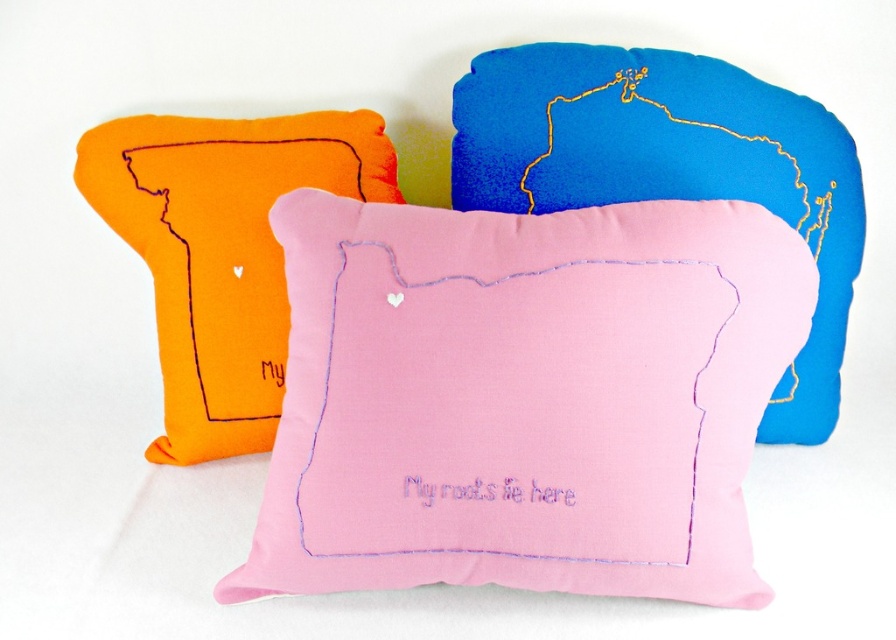
Does pink fabric pillow at center have a lesser height compared to orange felt pillow at left?

No, pink fabric pillow at center is not shorter than orange felt pillow at left.

What do you see at coordinates (524, 397) in the screenshot?
I see `pink fabric pillow at center` at bounding box center [524, 397].

Image resolution: width=896 pixels, height=640 pixels. Describe the element at coordinates (524, 397) in the screenshot. I see `pink fabric pillow at center` at that location.

Identify the location of pink fabric pillow at center. (524, 397).

Who is positioned more to the right, pink fabric pillow at center or pink fabric cushion at center?

pink fabric cushion at center is more to the right.

Can you confirm if pink fabric pillow at center is positioned above pink fabric cushion at center?

Incorrect, pink fabric pillow at center is not positioned above pink fabric cushion at center.

What do you see at coordinates (524, 397) in the screenshot? The width and height of the screenshot is (896, 640). I see `pink fabric pillow at center` at bounding box center [524, 397].

You are a GUI agent. You are given a task and a screenshot of the screen. Output one action in this format:
    pyautogui.click(x=<x>, y=<y>)
    Task: Click on the pink fabric pillow at center
    This screenshot has width=896, height=640.
    Given the screenshot: What is the action you would take?
    pyautogui.click(x=524, y=397)

I want to click on pink fabric cushion at center, so click(672, 170).

From the picture: Does pink fabric cushion at center have a larger size compared to orange felt pillow at left?

Correct, pink fabric cushion at center is larger in size than orange felt pillow at left.

Which is behind, point (854, 264) or point (355, 129)?

The point (355, 129) is more distant.

The width and height of the screenshot is (896, 640). Find the location of `pink fabric cushion at center`. pink fabric cushion at center is located at coordinates (672, 170).